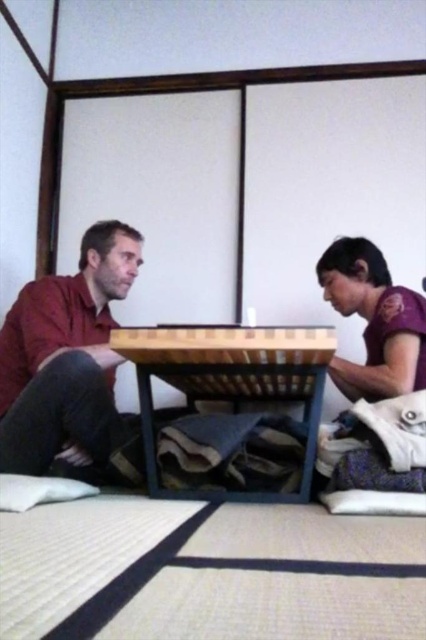
Question: Which point is farther to the camera?

Choices:
 (A) (209, 369)
 (B) (69, 308)

Answer: (B)

Question: Which object is the closest to the natural fiber mattress at lower center?

Choices:
 (A) matte wood table at center
 (B) purple matte shirt at lower right
 (C) bamboo table at center

Answer: (C)

Question: Does natural fiber mattress at lower center have a larger size compared to matte wood table at center?

Choices:
 (A) yes
 (B) no

Answer: (B)

Question: Is matte wood table at center positioned in front of purple matte shirt at lower right?

Choices:
 (A) yes
 (B) no

Answer: (A)

Question: Which object appears farthest from the camera in this image?

Choices:
 (A) matte red shirt at left
 (B) matte wood table at center
 (C) purple matte shirt at lower right

Answer: (C)

Question: Is matte red shirt at left to the left of purple matte shirt at lower right from the viewer's perspective?

Choices:
 (A) yes
 (B) no

Answer: (A)